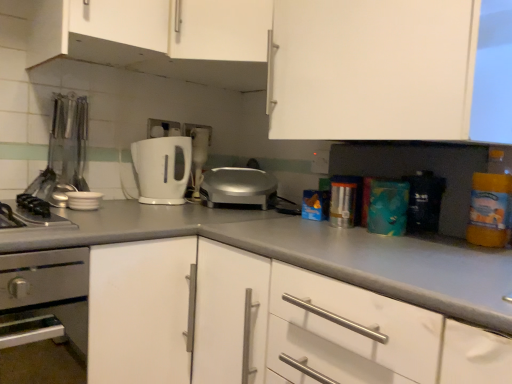
Question: Is white matte cabinet at center, acting as the 4th cabinetry starting from the top, bigger or smaller than white matte cabinet at upper center, arranged as the fourth cabinetry when ordered from the bottom?

Choices:
 (A) big
 (B) small

Answer: (A)

Question: In the image, is white matte cabinet at center, the first cabinetry in the bottom-to-top sequence, positioned in front of or behind white matte cabinet at upper center, which ranks as the 1th cabinetry in top-to-bottom order?

Choices:
 (A) front
 (B) behind

Answer: (A)

Question: Estimate the real-world distances between objects in this image. Which object is closer to the white matte cabinet at upper center, arranged as the fourth cabinetry when ordered from the bottom?

Choices:
 (A) teal matte box at center, which is the first appliance from right to left
 (B) white matte cabinet at center, the first cabinetry in the bottom-to-top sequence
 (C) translucent plastic bottle at right
 (D) silver metallic toaster at center, which is the second toaster from left to right
 (E) stainless steel oven at lower left

Answer: (D)

Question: Based on their relative distances, which object is farther from the stainless steel oven at lower left?

Choices:
 (A) white matte cabinet at upper center, arranged as the fourth cabinetry when ordered from the bottom
 (B) metallic silver utensils at left, the 1th appliance positioned from the left
 (C) white plastic coffee machine at center
 (D) white matte cabinet at upper center, which is the 2th cabinetry from bottom to top
 (E) teal matte box at center, the 3th appliance when ordered from left to right

Answer: (E)